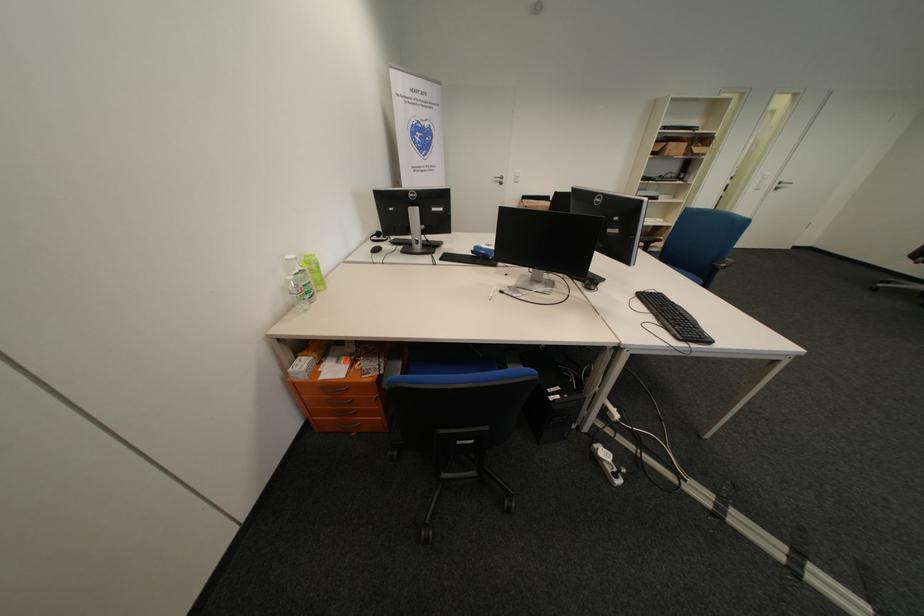
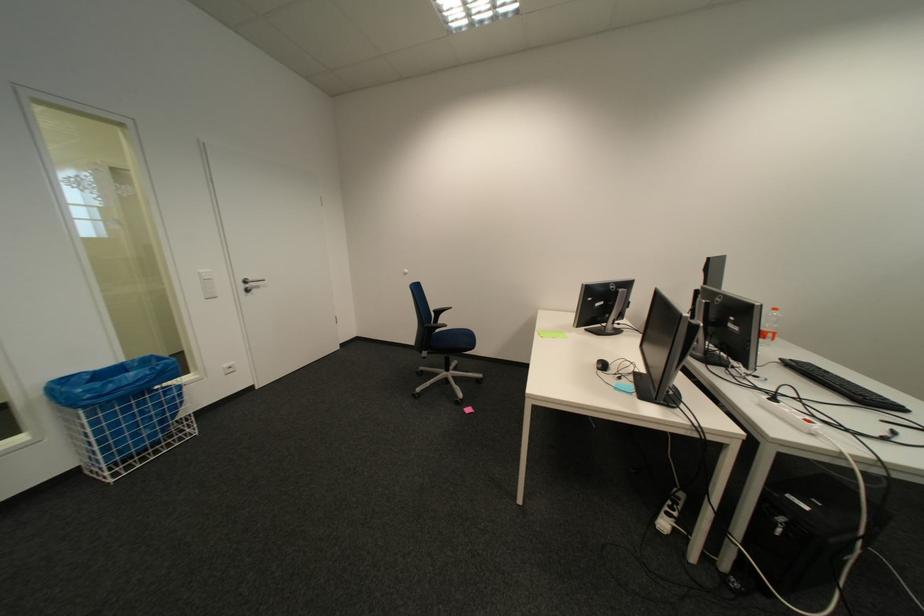
Question: I am providing you with two images of the same scene from different viewpoints. After the viewpoint changes to image2, which objects are now occluded?

Choices:
 (A) clear plastic bottle
 (B) black keyboard
 (C) silver door handle
 (D) none of these

Answer: (D)